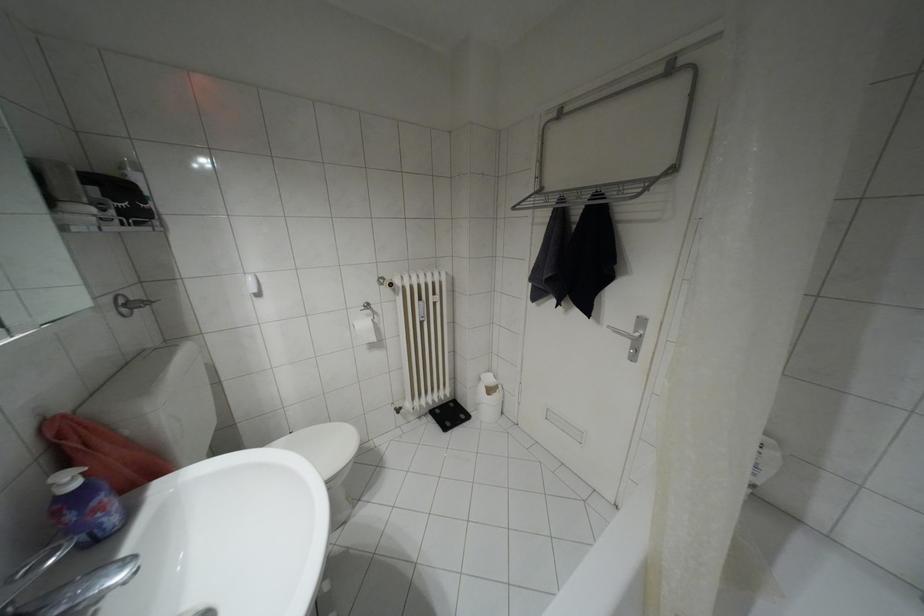
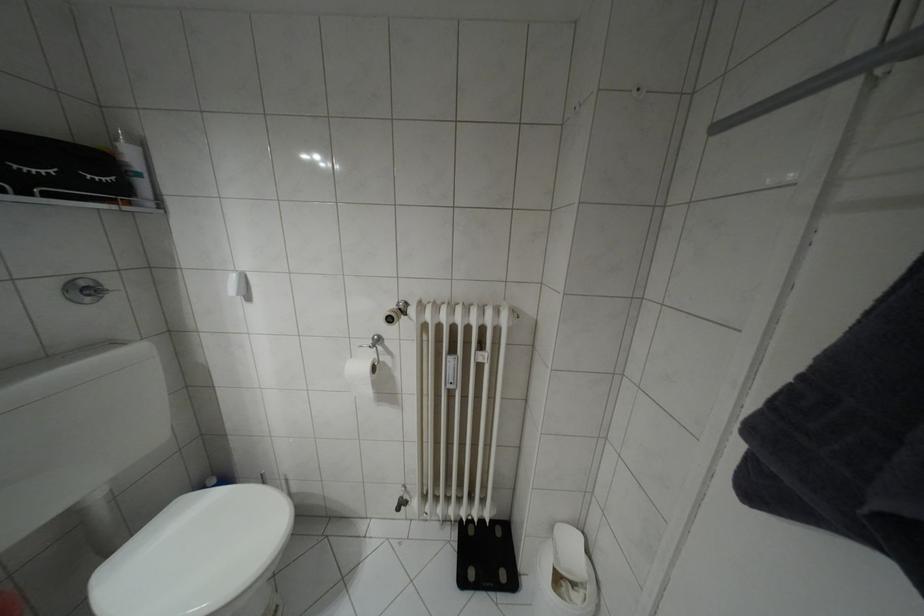
Locate, in the second image, the point that corresponds to (x=119, y=300) in the first image.

(81, 284)